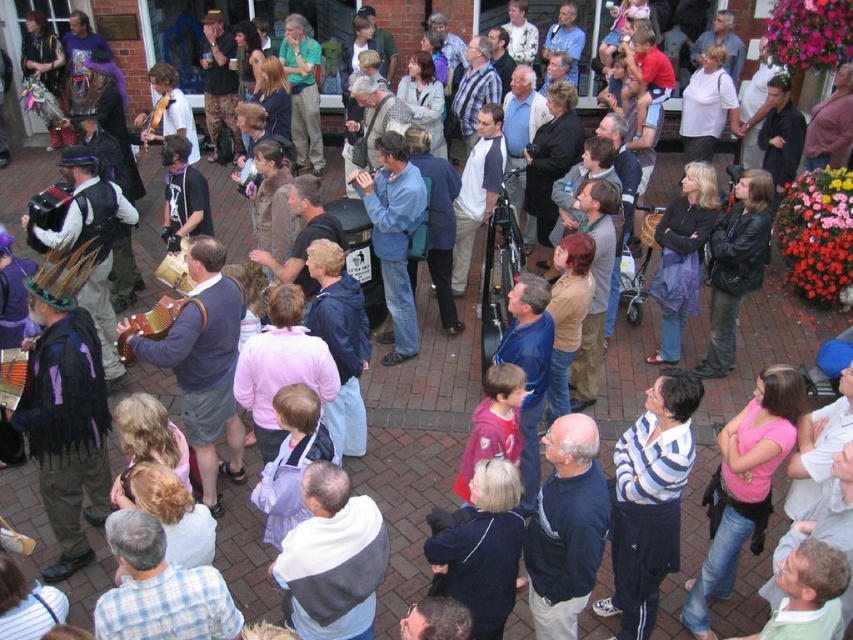
Describe the element at coordinates (202, 364) in the screenshot. The width and height of the screenshot is (853, 640). I see `brown leather accordion at center` at that location.

Between point (242, 474) and point (151, 312), which one is positioned behind?

The point (242, 474) is behind.

The image size is (853, 640). Find the location of `brown leather accordion at center`. brown leather accordion at center is located at coordinates (202, 364).

Which is behind, point (82, 442) or point (154, 129)?

Point (154, 129)

Can you confirm if black fuzzy vest at lower left is bigger than wooden acoustic guitar at center?

Indeed, black fuzzy vest at lower left has a larger size compared to wooden acoustic guitar at center.

Identify the location of black fuzzy vest at lower left. The width and height of the screenshot is (853, 640). (65, 404).

Does brown leather accordion at center have a smaller size compared to blue denim shirt at center?

No.

Is point (201, 276) closer to camera compared to point (384, 362)?

Yes, point (201, 276) is in front of point (384, 362).

Image resolution: width=853 pixels, height=640 pixels. I want to click on brown leather accordion at center, so click(202, 364).